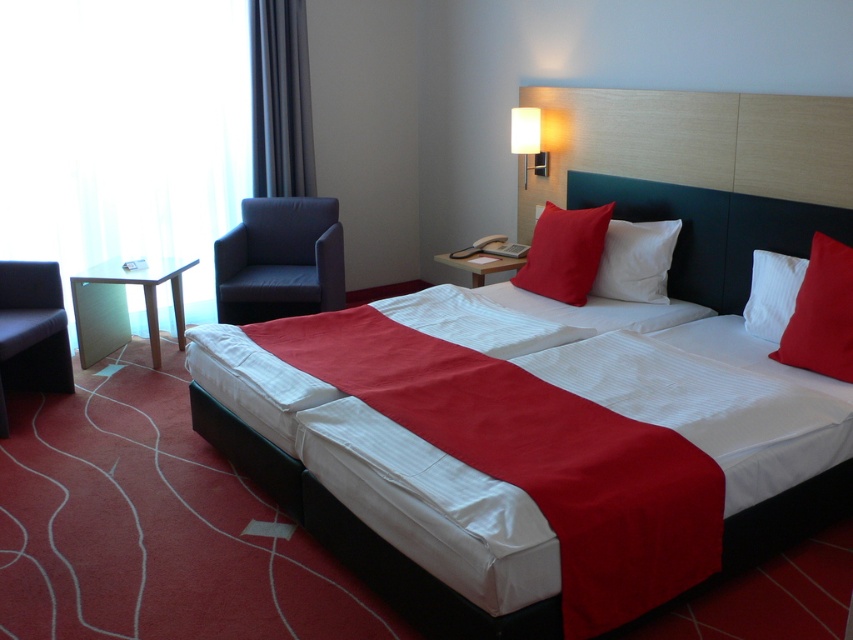
Question: Is the position of black leather armchair at left less distant than that of matte red pillow at center?

Choices:
 (A) yes
 (B) no

Answer: (A)

Question: Which of these objects is positioned closest to the white textured pillow at right?

Choices:
 (A) white soft pillow at upper right
 (B) wooden paneling at upper right

Answer: (B)

Question: Among these points, which one is farthest from the camera?

Choices:
 (A) (795, 296)
 (B) (830, 356)
 (C) (576, 230)
 (D) (277, 138)

Answer: (D)

Question: Does matte red pillow at right have a greater width compared to light brown wooden side table at left?

Choices:
 (A) yes
 (B) no

Answer: (B)

Question: Which object is farther from the camera taking this photo?

Choices:
 (A) wooden paneling at upper right
 (B) matte dark gray armchair at left
 (C) matte red pillow at right
 (D) white soft pillow at upper right

Answer: (B)

Question: Is dark gray fabric curtain at upper left wider than white soft pillow at upper right?

Choices:
 (A) no
 (B) yes

Answer: (A)